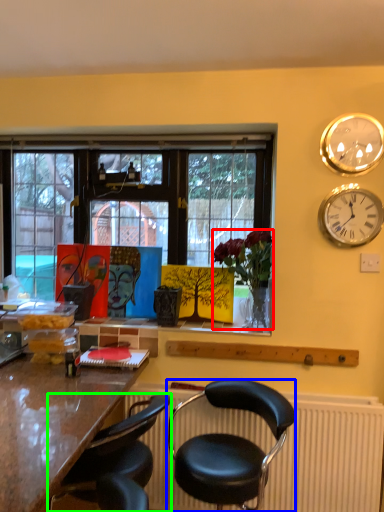
Question: Based on their relative distances, which object is nearer to houseplant (highlighted by a red box)? Choose from chair (highlighted by a blue box) and chair (highlighted by a green box).

Choices:
 (A) chair
 (B) chair

Answer: (A)